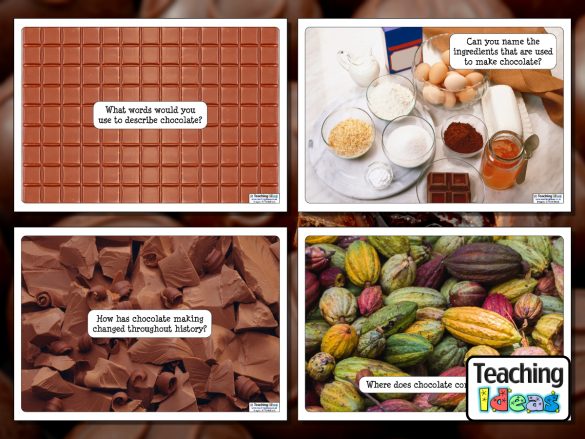
I want to click on white borders, so click(226, 204), click(227, 231), click(440, 21), click(415, 231).